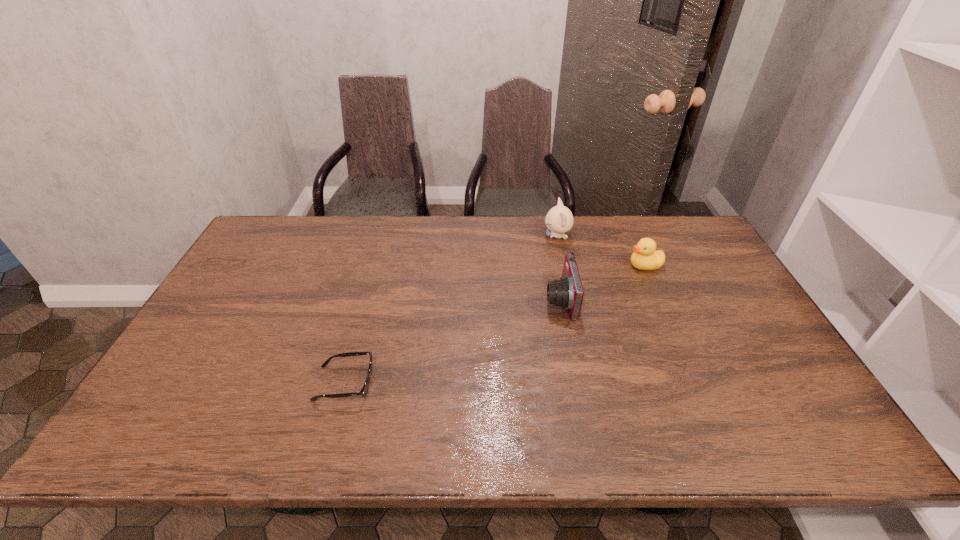
I want to click on blank space located 0.320m on the front-facing side of the second nearest object, so click(436, 300).

Find the location of a particular element. The image size is (960, 540). vacant space located on the front-facing side of the second nearest object is located at coordinates (409, 300).

Locate an element on the screen. free point located 0.130m at the beak of the rightmost object is located at coordinates (x=587, y=265).

I want to click on free location located 0.210m at the beak of the rightmost object, so click(x=562, y=265).

Where is `vacant space located 0.320m at the beak of the rightmost object`? vacant space located 0.320m at the beak of the rightmost object is located at coordinates (528, 265).

Find the location of `vacant space located 0.170m on the lenses of the shortest object`. vacant space located 0.170m on the lenses of the shortest object is located at coordinates (443, 383).

What are the coordinates of `object situated at the far edge` in the screenshot? It's located at (559, 219).

Find the location of a particular element. Image resolution: width=960 pixels, height=540 pixels. free space at the far edge of the desktop is located at coordinates (348, 254).

Image resolution: width=960 pixels, height=540 pixels. I want to click on vacant space at the near edge of the desktop, so click(491, 435).

In the image, there is a desktop. Where is `vacant space at the left edge`? The width and height of the screenshot is (960, 540). vacant space at the left edge is located at coordinates (260, 259).